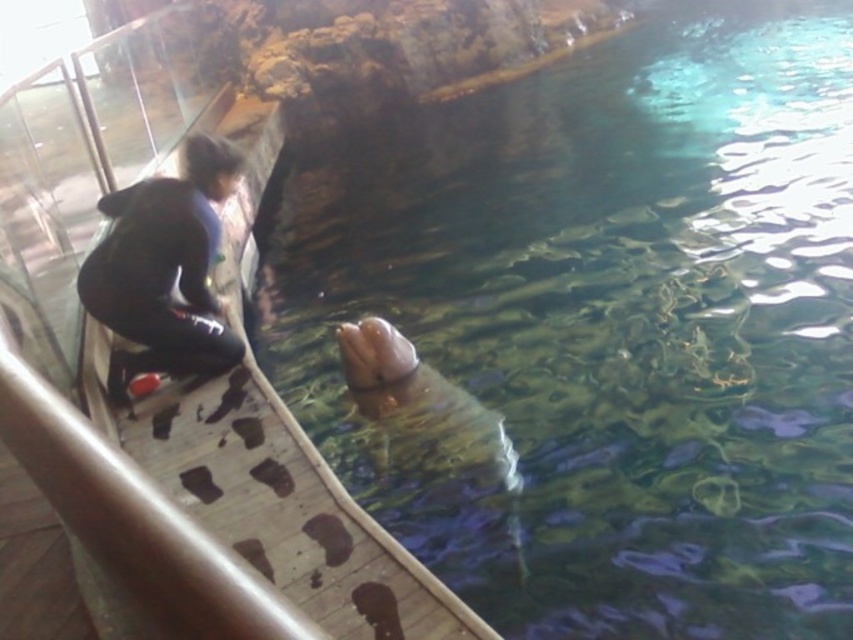
Does clear water at seal upper have a lesser width compared to black matte jacket at left?

Incorrect, clear water at seal upper's width is not less than black matte jacket at left's.

Who is higher up, clear water at seal upper or black matte jacket at left?

Positioned higher is clear water at seal upper.

The width and height of the screenshot is (853, 640). In order to click on clear water at seal upper in this screenshot , I will do `click(599, 328)`.

This screenshot has width=853, height=640. Find the location of `clear water at seal upper`. clear water at seal upper is located at coordinates (599, 328).